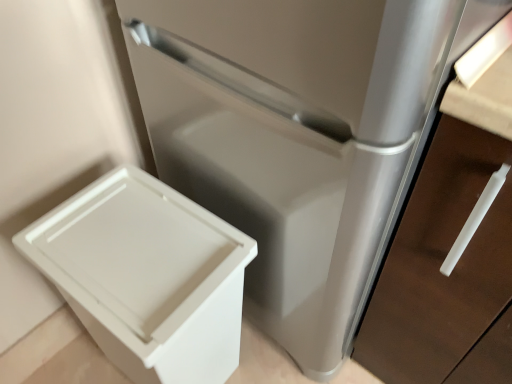
What is the approximate height of white plastic bin at lower left?

It is 22.29 inches.

The image size is (512, 384). Describe the element at coordinates (147, 276) in the screenshot. I see `white plastic bin at lower left` at that location.

Locate an element on the screen. The width and height of the screenshot is (512, 384). white plastic bin at lower left is located at coordinates (147, 276).

In order to face satin silver drawer at lower right, should I rotate leftwards or rightwards?

It's best to rotate right around 31.700 degrees.

You are a GUI agent. You are given a task and a screenshot of the screen. Output one action in this format:
    pyautogui.click(x=<x>, y=<y>)
    Task: Click on the satin silver drawer at lower right
    The width and height of the screenshot is (512, 384).
    Given the screenshot: What is the action you would take?
    (x=445, y=276)

The image size is (512, 384). What do you see at coordinates (445, 276) in the screenshot?
I see `satin silver drawer at lower right` at bounding box center [445, 276].

Locate an element on the screen. The width and height of the screenshot is (512, 384). white plastic bin at lower left is located at coordinates (147, 276).

Between satin silver drawer at lower right and white plastic bin at lower left, which one appears on the left side from the viewer's perspective?

white plastic bin at lower left is more to the left.

Does satin silver drawer at lower right lie behind white plastic bin at lower left?

No, it is in front of white plastic bin at lower left.

Which is closer to the camera, (480, 358) or (223, 285)?

The point (223, 285) is in front.

From the image's perspective, who appears lower, satin silver drawer at lower right or white plastic bin at lower left?

white plastic bin at lower left.

From a real-world perspective, who is located lower, satin silver drawer at lower right or white plastic bin at lower left?

In real-world perspective, white plastic bin at lower left is lower.

Considering the sizes of objects satin silver drawer at lower right and white plastic bin at lower left in the image provided, who is wider, satin silver drawer at lower right or white plastic bin at lower left?

satin silver drawer at lower right is wider.

Considering the sizes of objects satin silver drawer at lower right and white plastic bin at lower left in the image provided, who is shorter, satin silver drawer at lower right or white plastic bin at lower left?

white plastic bin at lower left.

Which of these two, satin silver drawer at lower right or white plastic bin at lower left, is bigger?

satin silver drawer at lower right is bigger.

Would you say satin silver drawer at lower right is outside white plastic bin at lower left?

That's correct, satin silver drawer at lower right is outside of white plastic bin at lower left.

Would you say satin silver drawer at lower right is a long distance from white plastic bin at lower left?

No, there isn't a large distance between satin silver drawer at lower right and white plastic bin at lower left.

Consider the image. Is satin silver drawer at lower right turned away from white plastic bin at lower left?

satin silver drawer at lower right does not have its back to white plastic bin at lower left.

How many degrees apart are the facing directions of satin silver drawer at lower right and white plastic bin at lower left?

satin silver drawer at lower right and white plastic bin at lower left are facing 1.58 degrees away from each other.

How far apart are satin silver drawer at lower right and white plastic bin at lower left?

A distance of 16.53 inches exists between satin silver drawer at lower right and white plastic bin at lower left.

Find the location of a particular element. This screenshot has width=512, height=384. waste container directly beneath the satin silver drawer at lower right (from a real-world perspective) is located at coordinates (147, 276).

Which is more to the left, white plastic bin at lower left or satin silver drawer at lower right?

Positioned to the left is white plastic bin at lower left.

Which object is further away from the camera, white plastic bin at lower left or satin silver drawer at lower right?

white plastic bin at lower left.

Is point (73, 219) in front of point (414, 255)?

That is False.

From the image's perspective, which object appears higher, white plastic bin at lower left or satin silver drawer at lower right?

satin silver drawer at lower right.

From a real-world perspective, who is located higher, white plastic bin at lower left or satin silver drawer at lower right?

In real-world perspective, satin silver drawer at lower right is above.

Between white plastic bin at lower left and satin silver drawer at lower right, which one has larger width?

Wider between the two is satin silver drawer at lower right.

Considering the sizes of objects white plastic bin at lower left and satin silver drawer at lower right in the image provided, who is shorter, white plastic bin at lower left or satin silver drawer at lower right?

white plastic bin at lower left.

Who is smaller, white plastic bin at lower left or satin silver drawer at lower right?

With smaller size is white plastic bin at lower left.

Is white plastic bin at lower left inside the boundaries of satin silver drawer at lower right, or outside?

white plastic bin at lower left cannot be found inside satin silver drawer at lower right.

Are white plastic bin at lower left and satin silver drawer at lower right located far from each other?

No, white plastic bin at lower left is not far away from satin silver drawer at lower right.

Could you tell me if white plastic bin at lower left is facing satin silver drawer at lower right?

No, white plastic bin at lower left is not facing towards satin silver drawer at lower right.

In the scene shown: Can you tell me how much white plastic bin at lower left and satin silver drawer at lower right differ in facing direction?

1.58 degrees separate the facing orientations of white plastic bin at lower left and satin silver drawer at lower right.

Where is `waste container below the satin silver drawer at lower right (from the image's perspective)`? This screenshot has height=384, width=512. waste container below the satin silver drawer at lower right (from the image's perspective) is located at coordinates (147, 276).

You are a GUI agent. You are given a task and a screenshot of the screen. Output one action in this format:
    pyautogui.click(x=<x>, y=<y>)
    Task: Click on the drawer that appears in front of the white plastic bin at lower left
    This screenshot has height=384, width=512.
    Given the screenshot: What is the action you would take?
    pyautogui.click(x=445, y=276)

Image resolution: width=512 pixels, height=384 pixels. There is a white plastic bin at lower left. Identify the location of drawer above it (from a real-world perspective). (445, 276).